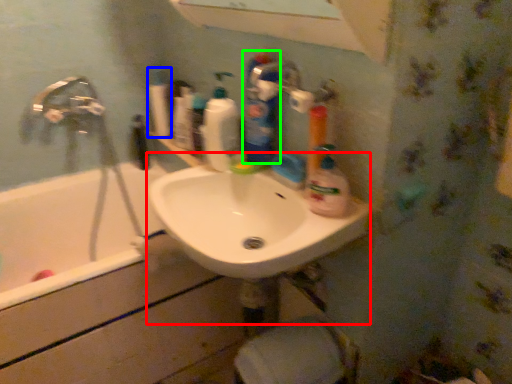
Question: Estimate the real-world distances between objects in this image. Which object is farther from sink (highlighted by a red box), cleaning product (highlighted by a blue box) or cleaning product (highlighted by a green box)?

Choices:
 (A) cleaning product
 (B) cleaning product

Answer: (A)